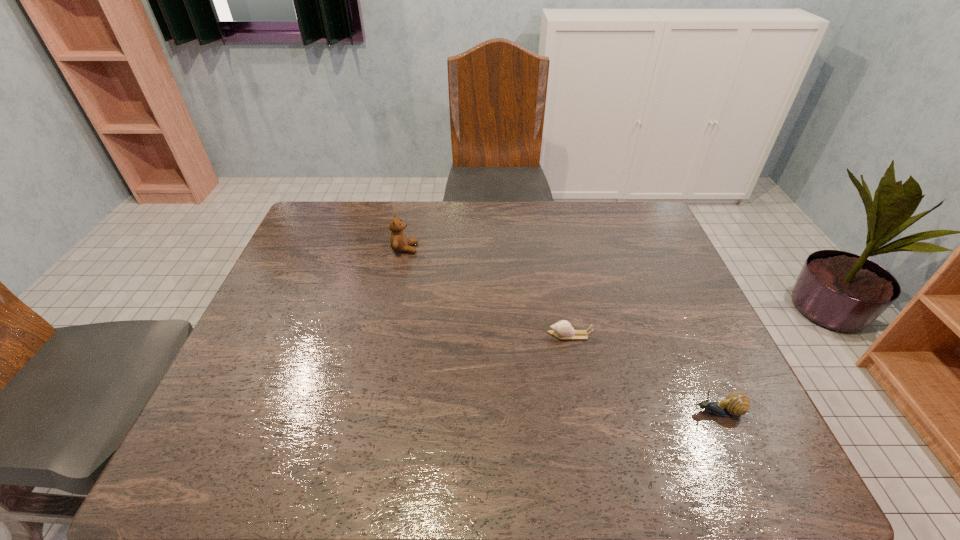
Image resolution: width=960 pixels, height=540 pixels. What are the coordinates of `free spot at the near left corner of the desktop` in the screenshot? It's located at (258, 474).

This screenshot has width=960, height=540. In the image, there is a desktop. Identify the location of vacant space at the far right corner. pos(638,225).

Find the location of a particular element. blank region between the second nearest object and the second shortest object is located at coordinates (644, 374).

Locate an element on the screen. Image resolution: width=960 pixels, height=540 pixels. vacant region between the teddy bear and the shortest object is located at coordinates (488, 292).

Locate an element on the screen. unoccupied area between the leftmost object and the second farthest object is located at coordinates (488, 292).

Where is `free space that is in between the second object from left to right and the rightmost object`? The image size is (960, 540). free space that is in between the second object from left to right and the rightmost object is located at coordinates (644, 374).

This screenshot has width=960, height=540. In order to click on vacant area that lies between the farther escargot and the teddy bear in this screenshot , I will do `click(488, 292)`.

I want to click on vacant space in between the farther escargot and the nearer escargot, so click(644, 374).

Where is `vacant space in between the leftmost object and the left escargot`? The width and height of the screenshot is (960, 540). vacant space in between the leftmost object and the left escargot is located at coordinates (488, 292).

Image resolution: width=960 pixels, height=540 pixels. What are the coordinates of `vacant area between the teddy bear and the shortest object` in the screenshot? It's located at (488, 292).